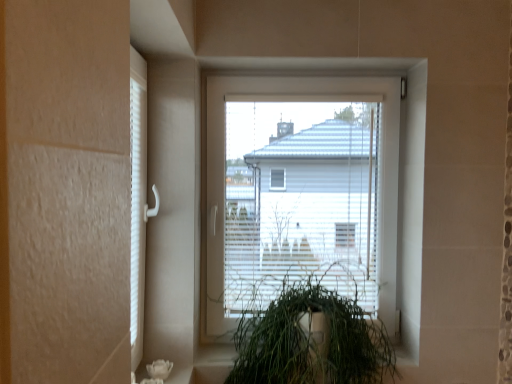
Image resolution: width=512 pixels, height=384 pixels. Find the location of `white plastic window at center`. white plastic window at center is located at coordinates (301, 192).

In order to face white plastic window at center, should I rotate leftwards or rightwards?

Rotate your view right by about 6.475°.

This screenshot has height=384, width=512. Describe the element at coordinates (301, 192) in the screenshot. I see `white plastic window at center` at that location.

Locate an element on the screen. green leafy plant at center is located at coordinates (311, 340).

Image resolution: width=512 pixels, height=384 pixels. What do you see at coordinates (311, 340) in the screenshot?
I see `green leafy plant at center` at bounding box center [311, 340].

I want to click on white plastic window at center, so click(x=301, y=192).

Can you confirm if white plastic window at center is positioned to the left of green leafy plant at center?

No.

Which object is further away from the camera, white plastic window at center or green leafy plant at center?

Positioned behind is white plastic window at center.

Is point (270, 235) behind point (322, 356)?

Yes.

From the image's perspective, would you say white plastic window at center is shown under green leafy plant at center?

Actually, white plastic window at center appears above green leafy plant at center in the image.

From a real-world perspective, which object rests below the other?

green leafy plant at center.

Is white plastic window at center wider than green leafy plant at center?

No.

In terms of height, does white plastic window at center look taller or shorter compared to green leafy plant at center?

white plastic window at center is taller than green leafy plant at center.

Considering the sizes of objects white plastic window at center and green leafy plant at center in the image provided, who is smaller, white plastic window at center or green leafy plant at center?

With smaller size is white plastic window at center.

Is white plastic window at center not inside green leafy plant at center?

Yes, white plastic window at center is outside of green leafy plant at center.

Is there a large distance between white plastic window at center and green leafy plant at center?

No, white plastic window at center is not far from green leafy plant at center.

Is white plastic window at center positioned with its back to green leafy plant at center?

No, white plastic window at center is not facing the opposite direction of green leafy plant at center.

Find the location of `houseplant below the white plastic window at center (from the image's perspective)`. houseplant below the white plastic window at center (from the image's perspective) is located at coordinates (311, 340).

Is green leafy plant at center to the left of white plastic window at center from the viewer's perspective?

Yes.

Which is behind, green leafy plant at center or white plastic window at center?

white plastic window at center is further from the camera.

Which is in front, point (236, 350) or point (379, 111)?

The point (236, 350) is closer to the camera.

From the image's perspective, is green leafy plant at center beneath white plastic window at center?

Yes.

From a real-world perspective, between green leafy plant at center and white plastic window at center, who is vertically lower?

green leafy plant at center, from a real-world perspective.

Looking at this image, is green leafy plant at center wider than white plastic window at center?

Indeed, green leafy plant at center has a greater width compared to white plastic window at center.

Who is taller, green leafy plant at center or white plastic window at center?

Standing taller between the two is white plastic window at center.

Looking at this image, between green leafy plant at center and white plastic window at center, which one has smaller size?

white plastic window at center.

Can white plastic window at center be found inside green leafy plant at center?

No.

Looking at this image, would you consider green leafy plant at center to be distant from white plastic window at center?

green leafy plant at center is actually quite close to white plastic window at center.

Is green leafy plant at center oriented away from white plastic window at center?

Correct, green leafy plant at center is looking away from white plastic window at center.

Can you tell me how much green leafy plant at center and white plastic window at center differ in facing direction?

0.258 degrees separate the facing orientations of green leafy plant at center and white plastic window at center.

The height and width of the screenshot is (384, 512). Find the location of `houseplant lying in front of the white plastic window at center`. houseplant lying in front of the white plastic window at center is located at coordinates (311, 340).

You are a GUI agent. You are given a task and a screenshot of the screen. Output one action in this format:
    pyautogui.click(x=<x>, y=<y>)
    Task: Click on the houseplant below the white plastic window at center (from the image's perspective)
    The width and height of the screenshot is (512, 384).
    Given the screenshot: What is the action you would take?
    pyautogui.click(x=311, y=340)

The height and width of the screenshot is (384, 512). In the image, there is a white plastic window at center. Find the location of `houseplant below it (from a real-world perspective)`. houseplant below it (from a real-world perspective) is located at coordinates (311, 340).